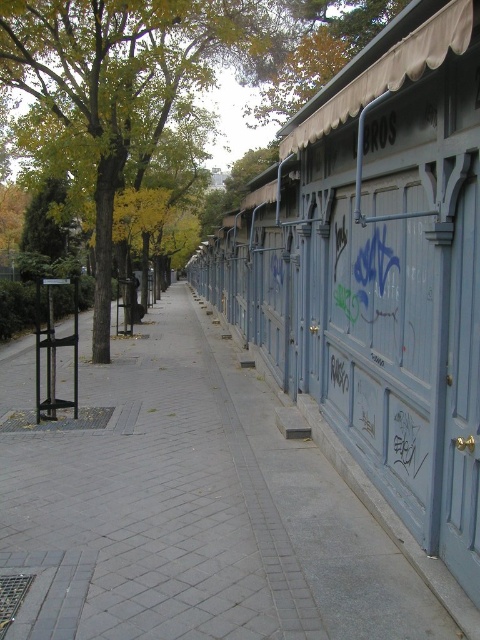
You are standing at the black metal post with a sign on the left side of the image. You want to walk to the blue painted wood shed at right. Which direction should you head towards?

You should head towards the right direction to reach the blue painted wood shed at right since it is located at point (x=377, y=269) which is to the right side of the image from your current position at the black metal post on the left.

You are a delivery person trying to park your bike. You see the gray brick pavement at center and the blue painted wood shed at right. Which location is closer to the black metal post with a sign on the left side?

The gray brick pavement at center is closer to the black metal post with a sign on the left side because it is positioned to the left of the blue painted wood shed at right, which is farther away from the post.